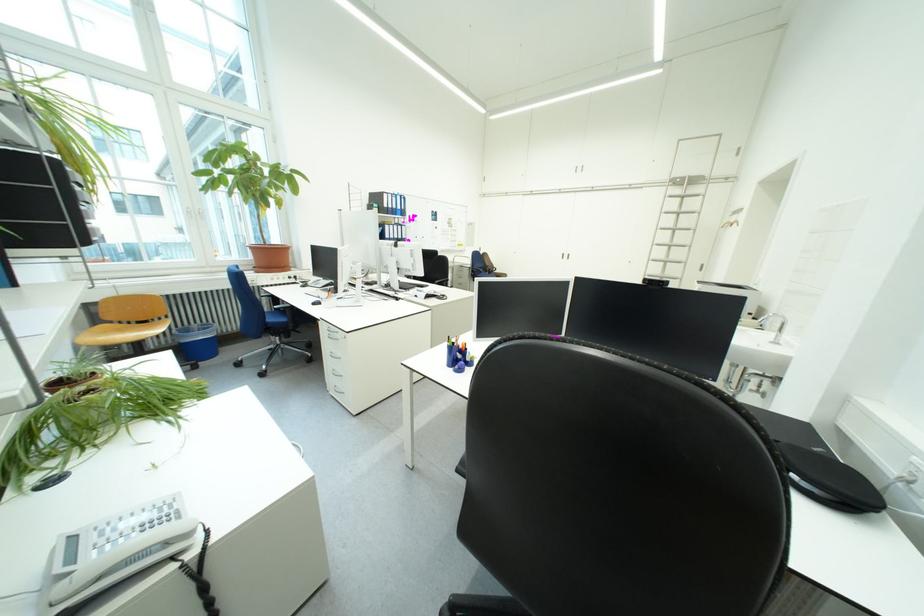
The location [119,557] corresponds to which object?

It refers to a telephone handset.